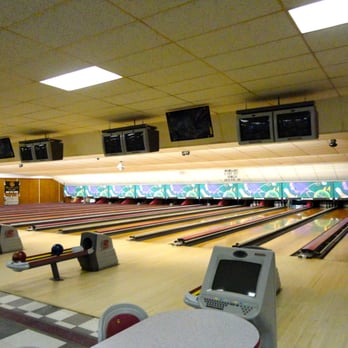
In order to click on screens in this screenshot , I will do pyautogui.click(x=7, y=153), pyautogui.click(x=26, y=156), pyautogui.click(x=40, y=153), pyautogui.click(x=108, y=144), pyautogui.click(x=137, y=145), pyautogui.click(x=181, y=124), pyautogui.click(x=254, y=130), pyautogui.click(x=301, y=131), pyautogui.click(x=236, y=278).